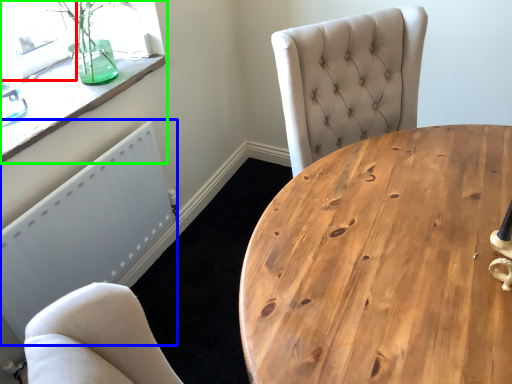
Question: Which is farther away from window screen (highlighted by a red box)? radiator (highlighted by a blue box) or window (highlighted by a green box)?

Choices:
 (A) radiator
 (B) window

Answer: (A)